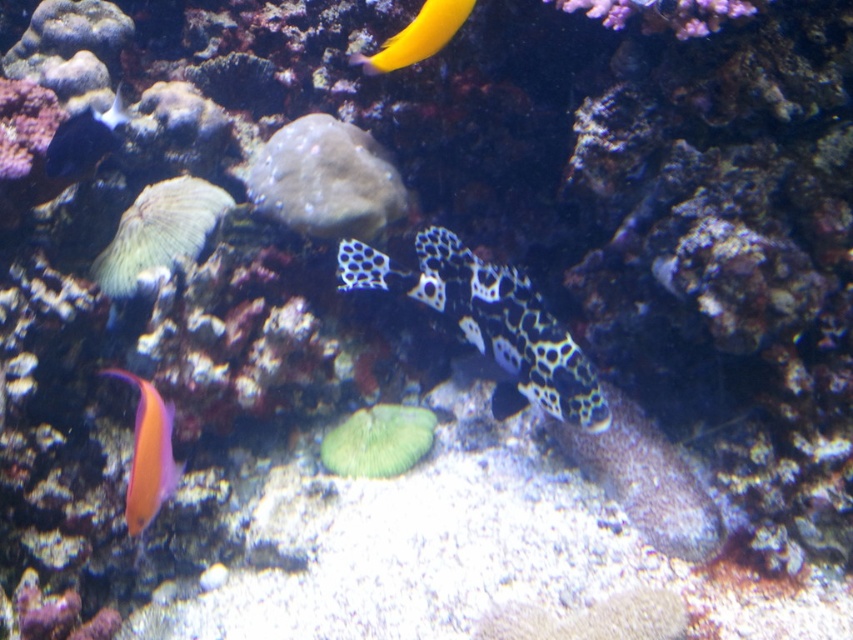
You are a marine biologist observing the underwater scene. You notice the green coral at center and the shiny yellow fish at upper center. Which object occupies a bigger area in the image?

The green coral at center has a larger size compared to the shiny yellow fish at upper center, so it occupies a bigger area in the image.

You are a marine biologist observing the underwater scene. You notice the black and white spotted fish at center and the green coral at center. Which object is bigger in size?

The black and white spotted fish at center is larger in size compared to the green coral at center.